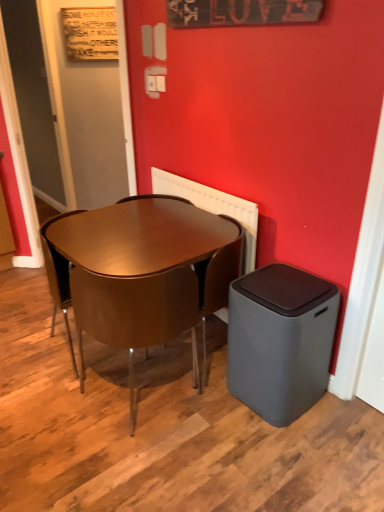
Question: Can you confirm if gray matte trash bin at lower right is smaller than matte gray door at upper left, placed as the first door when sorted from left to right?

Choices:
 (A) yes
 (B) no

Answer: (A)

Question: Could matte gray door at upper left, which is the 2th door in right-to-left order, be considered to be inside gray matte trash bin at lower right?

Choices:
 (A) no
 (B) yes

Answer: (A)

Question: Can you confirm if gray matte trash bin at lower right is wider than matte gray door at upper left, which is the 2th door in right-to-left order?

Choices:
 (A) no
 (B) yes

Answer: (B)

Question: Could you tell me if gray matte trash bin at lower right is turned towards matte gray door at upper left, placed as the first door when sorted from left to right?

Choices:
 (A) yes
 (B) no

Answer: (B)

Question: Considering the relative sizes of gray matte trash bin at lower right and matte gray door at upper left, which is the 2th door in right-to-left order, in the image provided, is gray matte trash bin at lower right shorter than matte gray door at upper left, which is the 2th door in right-to-left order,?

Choices:
 (A) yes
 (B) no

Answer: (A)

Question: Looking at the image, does brown glossy chair at center, acting as the 1th chair starting from the right, seem bigger or smaller compared to glossy brown chair at center, which is counted as the 1th chair, starting from the left?

Choices:
 (A) small
 (B) big

Answer: (A)

Question: In terms of height, does brown glossy chair at center, which is counted as the third chair, starting from the left, look taller or shorter compared to glossy brown chair at center, which is counted as the 1th chair, starting from the left?

Choices:
 (A) short
 (B) tall

Answer: (A)

Question: In the image, is brown glossy chair at center, which is counted as the third chair, starting from the left, positioned in front of or behind glossy brown chair at center, which is counted as the 1th chair, starting from the left?

Choices:
 (A) behind
 (B) front

Answer: (B)

Question: Considering the relative positions of brown glossy chair at center, acting as the 1th chair starting from the right, and glossy brown chair at center, which is counted as the 1th chair, starting from the left, in the image provided, is brown glossy chair at center, acting as the 1th chair starting from the right, to the left or to the right of glossy brown chair at center, which is counted as the 1th chair, starting from the left,?

Choices:
 (A) right
 (B) left

Answer: (A)

Question: From the image's perspective, relative to white plastic radiator at upper center, is wooden signboard at upper left, positioned as the 1th bulletin board in back-to-front order, above or below?

Choices:
 (A) below
 (B) above

Answer: (B)

Question: Considering their positions, is wooden signboard at upper left, acting as the 2th bulletin board starting from the right, located in front of or behind white plastic radiator at upper center?

Choices:
 (A) behind
 (B) front

Answer: (A)

Question: In terms of width, does wooden signboard at upper left, positioned as the 1th bulletin board in left-to-right order, look wider or thinner when compared to white plastic radiator at upper center?

Choices:
 (A) wide
 (B) thin

Answer: (B)

Question: From a real-world perspective, is wooden signboard at upper left, acting as the 2th bulletin board starting from the right, positioned above or below white plastic radiator at upper center?

Choices:
 (A) above
 (B) below

Answer: (A)

Question: Choose the correct answer: Is matte gray door at upper left, which is the 2th door in right-to-left order, inside matte brown table at center or outside it?

Choices:
 (A) inside
 (B) outside

Answer: (B)

Question: Is matte gray door at upper left, placed as the first door when sorted from left to right, taller or shorter than matte brown table at center?

Choices:
 (A) short
 (B) tall

Answer: (B)